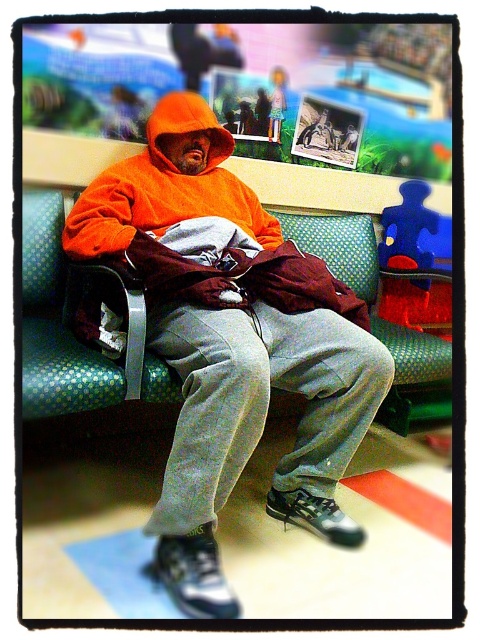
Is orange fleece hoodie at center below green dotted fabric bench at center?

Yes.

Does point (244, 365) come closer to viewer compared to point (45, 230)?

Yes, it is in front of point (45, 230).

Which is behind, point (253, 291) or point (409, 376)?

Positioned behind is point (409, 376).

The height and width of the screenshot is (640, 480). I want to click on orange fleece hoodie at center, so click(x=230, y=340).